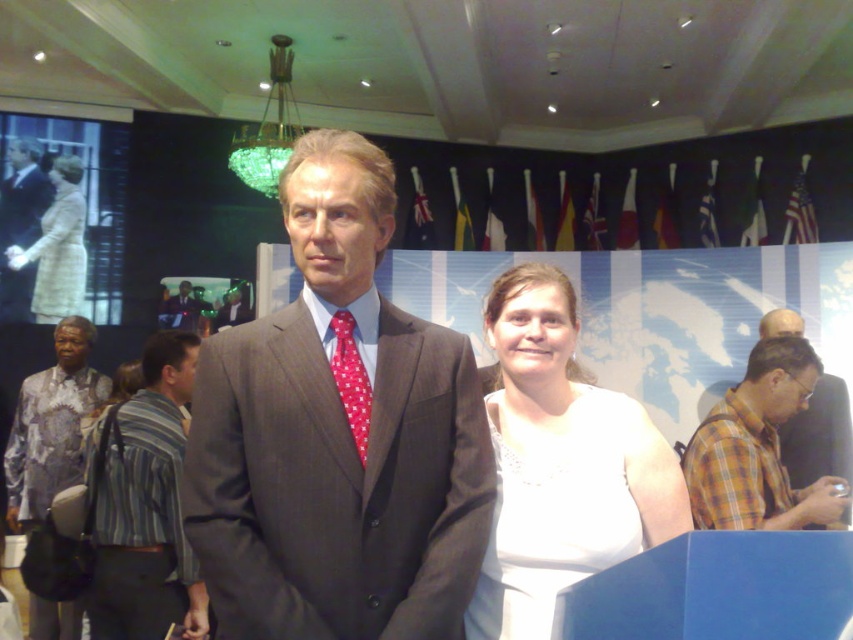
Who is higher up, matte brown suit at center or red dotted fabric tie at center?

matte brown suit at center is higher up.

Which is more to the left, matte brown suit at center or red dotted fabric tie at center?

Positioned to the left is matte brown suit at center.

Is point (283, 404) behind point (351, 353)?

That is False.

Identify the location of matte brown suit at center. (337, 436).

Between white satin dress at center and polished wood tie at center, which one is positioned lower?

white satin dress at center is lower down.

Is white satin dress at center below polished wood tie at center?

Yes, white satin dress at center is below polished wood tie at center.

Where is `white satin dress at center`? This screenshot has height=640, width=853. white satin dress at center is located at coordinates (561, 464).

Is plaid shirt at right below light beige wool coat at left?

Correct, plaid shirt at right is located below light beige wool coat at left.

Is plaid shirt at right to the right of light beige wool coat at left from the viewer's perspective?

Yes, plaid shirt at right is to the right of light beige wool coat at left.

Identify the location of plaid shirt at right. The width and height of the screenshot is (853, 640). 759,449.